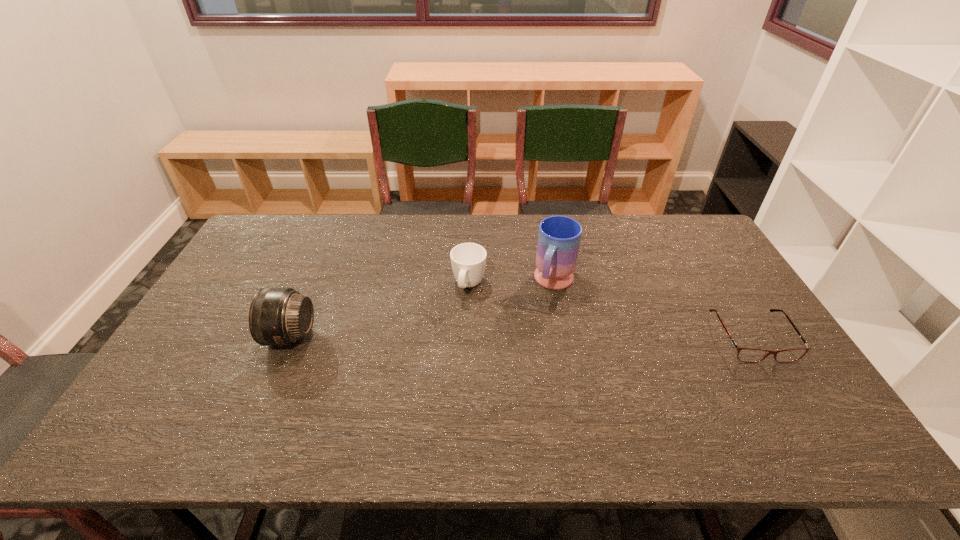
This screenshot has height=540, width=960. In order to click on vacant spot on the desktop that is between the second tallest object and the spectacles and is positioned on the side of the mug with the handle in this screenshot , I will do `click(530, 336)`.

The width and height of the screenshot is (960, 540). Identify the location of vacant spot on the desktop that is between the leftmost object and the shortest object and is positioned with the handle on the side of the cup. (452, 336).